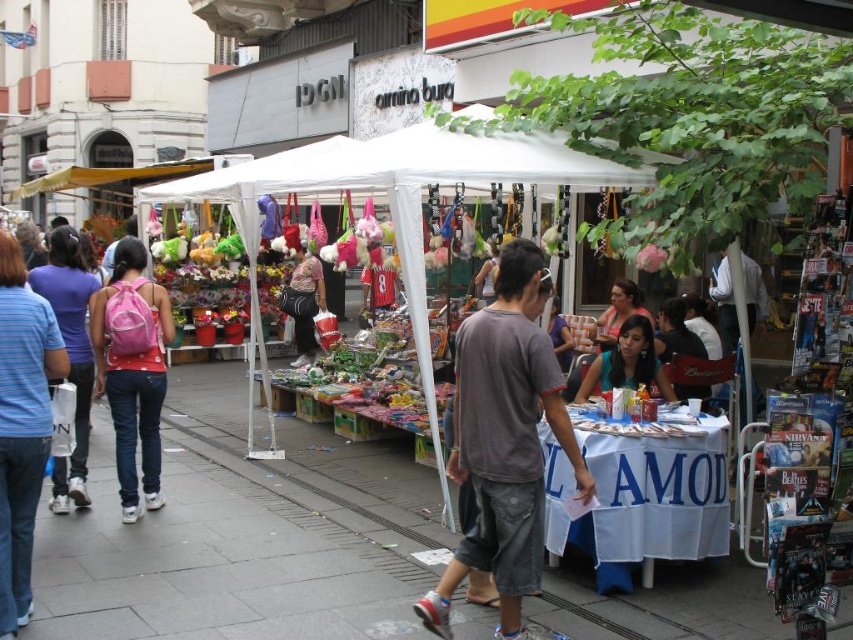
Question: In this image, where is gray concrete sidewalk at center located relative to pink backpack at left?

Choices:
 (A) left
 (B) right

Answer: (B)

Question: Estimate the real-world distances between objects in this image. Which object is farther from the blue striped shirt at left?

Choices:
 (A) gray cotton t-shirt at center
 (B) pink backpack at center
 (C) pink backpack at left
 (D) teal satin blouse at center

Answer: (B)

Question: Where is gray cotton t-shirt at center located in relation to pink fabric backpack at center in the image?

Choices:
 (A) below
 (B) above

Answer: (A)

Question: Among these objects, which one is farthest from the camera?

Choices:
 (A) teal satin blouse at center
 (B) gray cotton t-shirt at center

Answer: (A)

Question: Which object is the closest to the blue striped shirt at left?

Choices:
 (A) pink backpack at left
 (B) pink backpack at center
 (C) teal satin blouse at center
 (D) gray cotton t-shirt at center

Answer: (A)

Question: Is gray cotton t-shirt at center closer to camera compared to pink backpack at center?

Choices:
 (A) yes
 (B) no

Answer: (A)